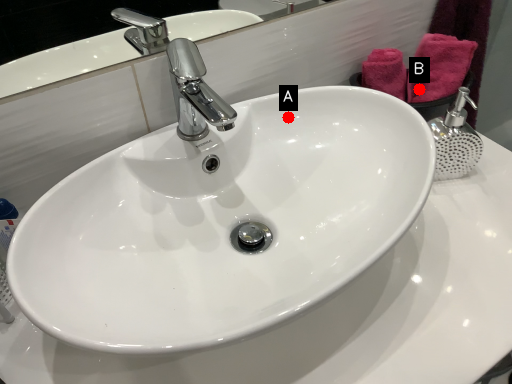
Question: Two points are circled on the image, labeled by A and B beside each circle. Which point is farther to the camera?

Choices:
 (A) A is further
 (B) B is further

Answer: (B)